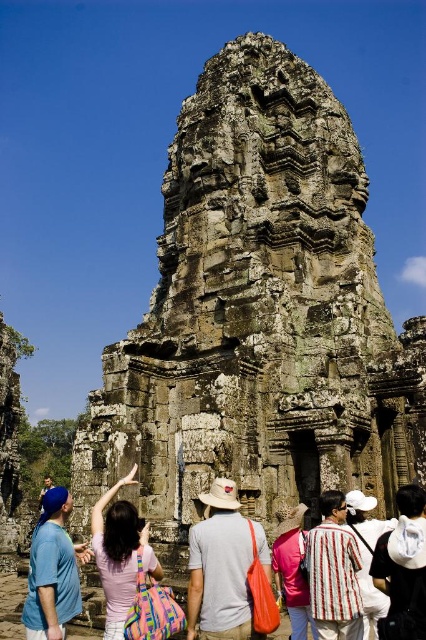
You are a photographer planning to capture a wide shot of the ancient stone tower. You notice the gray fabric hat at center and the blue denim jeans at lower left in your frame. Which object should you adjust your camera angle to remove first if you want to prioritize keeping the larger object in the scene?

Result: The gray fabric hat at center occupies less space than the blue denim jeans at lower left, so you should adjust your camera angle to remove the gray fabric hat at center first to keep the larger blue denim jeans at lower left in the scene.

You are a photographer aiming to capture a clear shot of the striped fabric shirt at center without any obstructions. Given that the gray fabric hat at center is currently blocking the view, can you adjust your position to achieve this? Please explain your reasoning.

The gray fabric hat at center is in front of the striped fabric shirt at center. By moving to a position behind the gray fabric hat at center, you can capture the striped fabric shirt at center without obstruction.

You are a tour guide leading a group to a historical site. You notice a tourist wearing a gray fabric hat at center and a striped fabric shirt at center. If you want to ensure social distancing between them and other tourists, what is the minimum safe distance you should maintain between this tourist and others?

The distance between the gray fabric hat at center and striped fabric shirt at center is 4.68 meters, so the minimum safe distance should be at least 4.68 meters to maintain social distancing between this tourist and others.